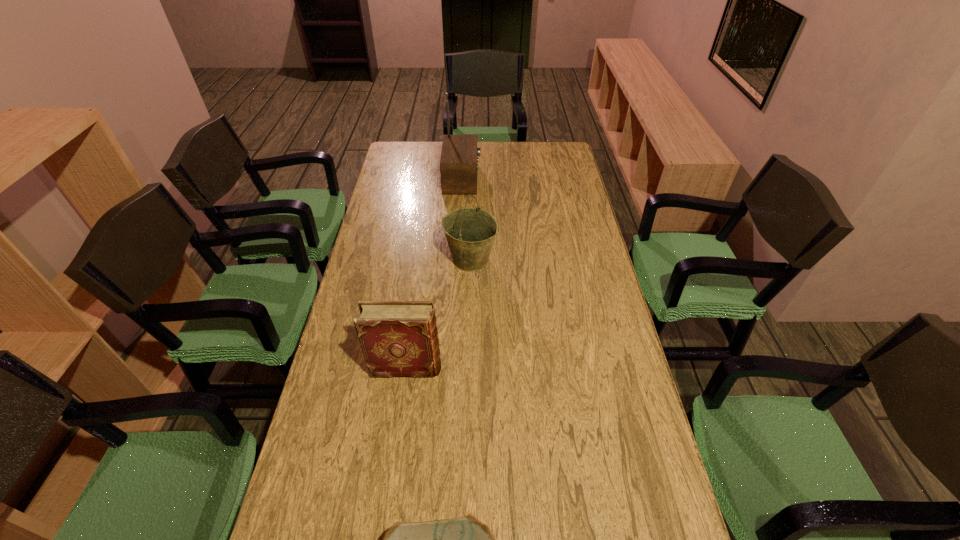
Identify the location of free space in the image that satisfies the following two spatial constraints: 1. on the front-facing side of the radio receiver; 2. on the right side of the third nearest object. The image size is (960, 540). (458, 260).